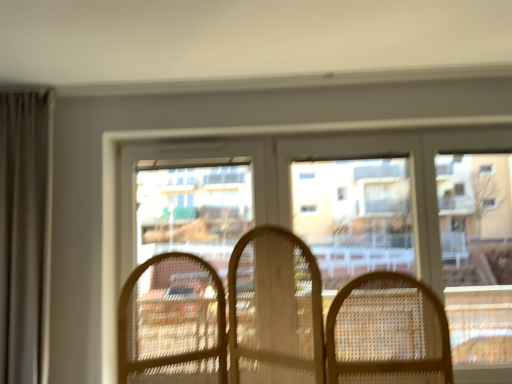
Question: From a real-world perspective, is clear plastic screen door at center physically below translucent wicker chairs at center?

Choices:
 (A) yes
 (B) no

Answer: (B)

Question: Can you confirm if clear plastic screen door at center is thinner than translucent wicker chairs at center?

Choices:
 (A) no
 (B) yes

Answer: (B)

Question: Is translucent wicker chairs at center completely or partially inside clear plastic screen door at center?

Choices:
 (A) no
 (B) yes

Answer: (A)

Question: Does clear plastic screen door at center come in front of translucent wicker chairs at center?

Choices:
 (A) yes
 (B) no

Answer: (B)

Question: Is clear plastic screen door at center to the left of translucent wicker chairs at center from the viewer's perspective?

Choices:
 (A) no
 (B) yes

Answer: (B)

Question: From the image's perspective, would you say clear plastic screen door at center is shown under translucent wicker chairs at center?

Choices:
 (A) yes
 (B) no

Answer: (B)

Question: Could you tell me if clear plastic window screen at center is turned towards clear plastic screen door at center?

Choices:
 (A) yes
 (B) no

Answer: (B)

Question: Does clear plastic window screen at center have a larger size compared to clear plastic screen door at center?

Choices:
 (A) no
 (B) yes

Answer: (A)

Question: Is clear plastic window screen at center at the left side of clear plastic screen door at center?

Choices:
 (A) no
 (B) yes

Answer: (A)

Question: Is clear plastic window screen at center with clear plastic screen door at center?

Choices:
 (A) no
 (B) yes

Answer: (A)

Question: Does clear plastic window screen at center have a greater height compared to clear plastic screen door at center?

Choices:
 (A) no
 (B) yes

Answer: (A)

Question: From a real-world perspective, is clear plastic window screen at center located beneath clear plastic screen door at center?

Choices:
 (A) yes
 (B) no

Answer: (B)

Question: Can you confirm if clear plastic window screen at center is wider than translucent wicker chairs at center?

Choices:
 (A) no
 (B) yes

Answer: (A)